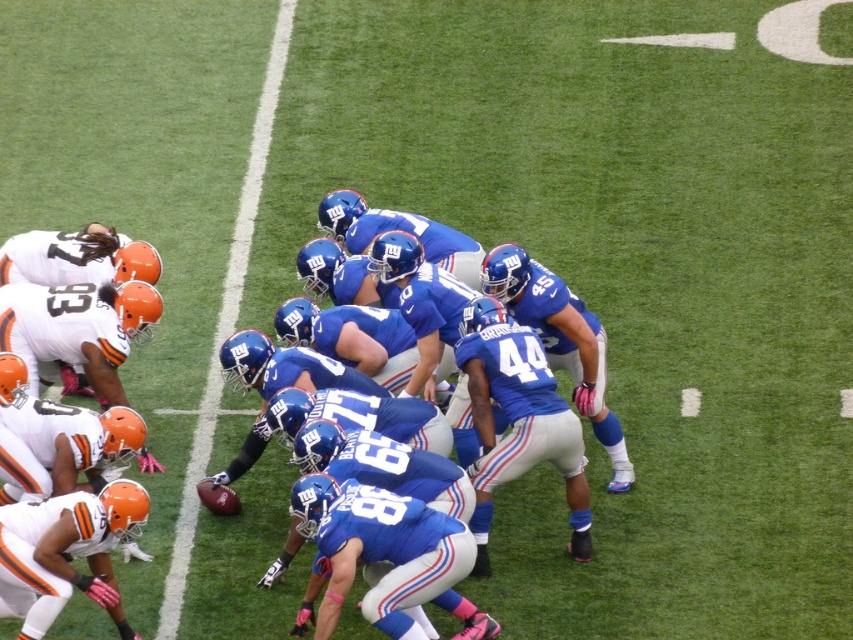
You are a referee standing at the center of the field. You need to check the distance between the white matte uniform at lower left and the matte orange helmet at left to ensure they are within the 1.2 meters minimum separation rule. Is the distance compliant?

The white matte uniform at lower left and the matte orange helmet at left are 1.12 meters apart, which is within the 1.2 meters minimum separation rule. The distance is compliant.

You are a referee standing at the center of the field. You notice a point marked at coordinates [334,339]. What object is located at this point?

The point at coordinates [334,339] corresponds to the blue fabric jersey at center.

You are a referee observing the football game. You need to determine if the blue fabric jersey at center is wider than the matte orange helmet at left. Based on the scene, can you confirm this?

The blue fabric jersey at center is wider than the matte orange helmet at left according to the description.